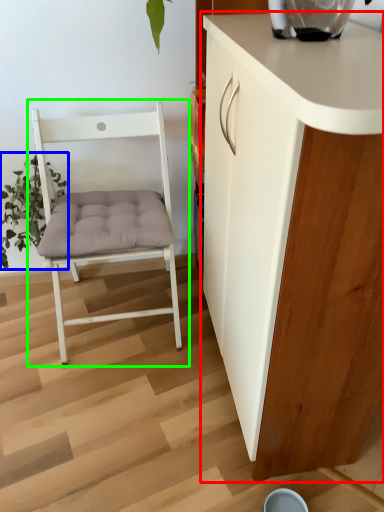
Question: Considering the real-world distances, which object is farthest from cabinetry (highlighted by a red box)? plant (highlighted by a blue box) or chair (highlighted by a green box)?

Choices:
 (A) plant
 (B) chair

Answer: (A)